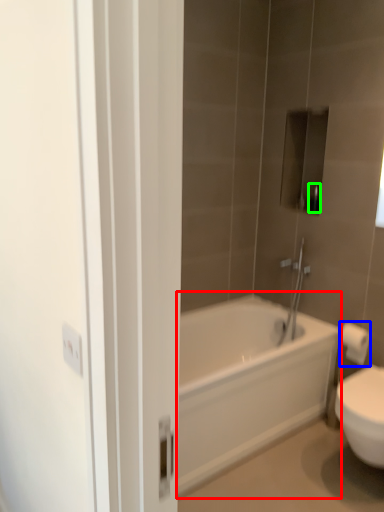
Question: Which is farther away from bathtub (highlighted by a red box)? toilet paper (highlighted by a blue box) or toiletry (highlighted by a green box)?

Choices:
 (A) toilet paper
 (B) toiletry

Answer: (B)